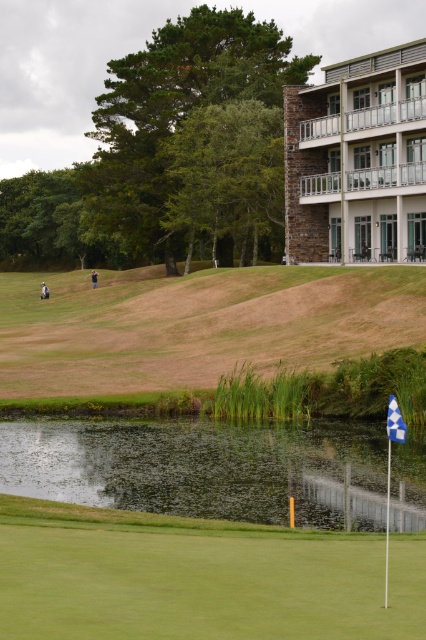
Question: Based on their relative distances, which object is farther from the green reflective water at lower center?

Choices:
 (A) stone brick building at upper right
 (B) green grass at lower center

Answer: (A)

Question: Which object appears farthest from the camera in this image?

Choices:
 (A) stone brick building at upper right
 (B) green reflective water at lower center

Answer: (A)

Question: Does green grass at lower center have a smaller size compared to green reflective water at lower center?

Choices:
 (A) no
 (B) yes

Answer: (B)

Question: Based on their relative distances, which object is farther from the green reflective water at lower center?

Choices:
 (A) blue fabric flag at lower right
 (B) green grass at lower center

Answer: (B)

Question: Where is green grass at lower center located in relation to stone brick building at upper right in the image?

Choices:
 (A) left
 (B) right

Answer: (A)

Question: Does green reflective water at lower center appear over blue fabric flag at lower right?

Choices:
 (A) yes
 (B) no

Answer: (B)